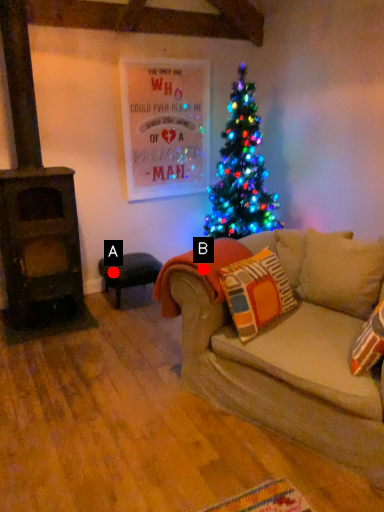
Question: Two points are circled on the image, labeled by A and B beside each circle. Which of the following is the farthest from the observer?

Choices:
 (A) A is further
 (B) B is further

Answer: (A)